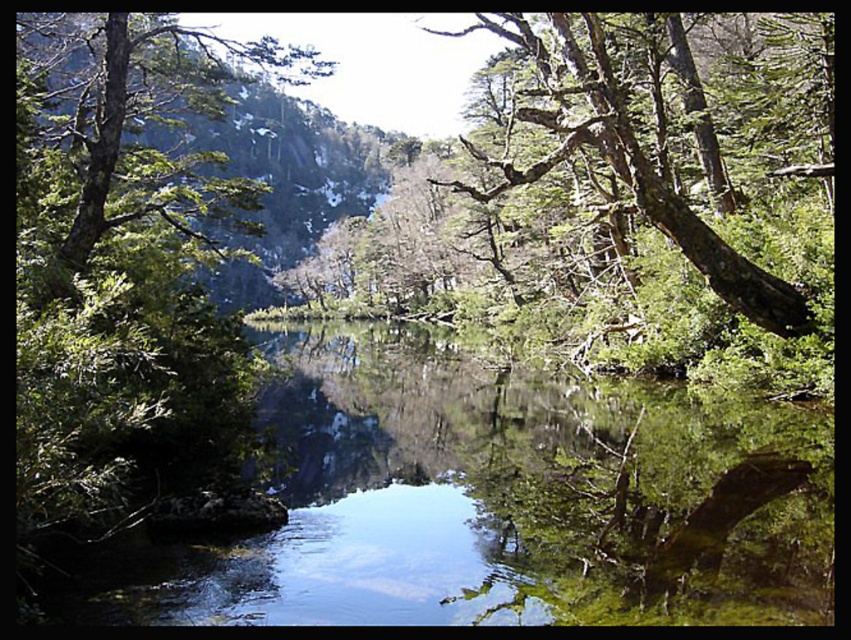
You are a GUI agent. You are given a task and a screenshot of the screen. Output one action in this format:
    pyautogui.click(x=<x>, y=<y>)
    Task: Click on the green leafy tree at upper left
    
    Given the screenshot: What is the action you would take?
    pyautogui.click(x=127, y=128)

Does green leafy tree at upper left have a greater width compared to green bark tree at upper right?

Indeed, green leafy tree at upper left has a greater width compared to green bark tree at upper right.

Which is behind, point (129, 212) or point (626, 170)?

Point (129, 212)

Identify the location of green leafy tree at upper left. The image size is (851, 640). (127, 128).